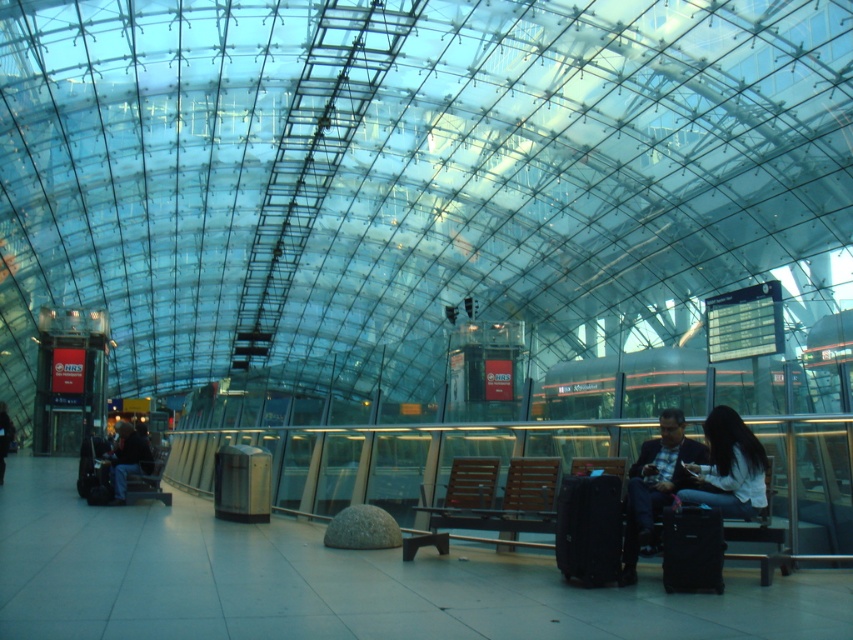
Can you confirm if black matte suitcase at lower center is taller than dark blue suit at right?

No, black matte suitcase at lower center is not taller than dark blue suit at right.

Based on the photo, is black matte suitcase at lower center thinner than dark blue suit at right?

Yes.

Measure the distance between black matte suitcase at lower center and camera.

21.57 feet

The image size is (853, 640). Identify the location of black matte suitcase at lower center. (589, 529).

Is wooden bench at center below dark blue suit at right?

Indeed, wooden bench at center is positioned under dark blue suit at right.

Consider the image. Who is taller, wooden bench at center or dark blue suit at right?

dark blue suit at right is taller.

Between point (614, 468) and point (659, 416), which one is positioned behind?

Positioned behind is point (659, 416).

Image resolution: width=853 pixels, height=640 pixels. Find the location of `wooden bench at center`. wooden bench at center is located at coordinates (502, 504).

Between black hard suitcase at lower right and dark blue jacket at left, which one appears on the right side from the viewer's perspective?

Positioned to the right is black hard suitcase at lower right.

Between black hard suitcase at lower right and dark blue jacket at left, which one has less height?

black hard suitcase at lower right

Who is more distant from viewer, [692,536] or [4,436]?

Point [4,436]

The image size is (853, 640). I want to click on black hard suitcase at lower right, so click(692, 548).